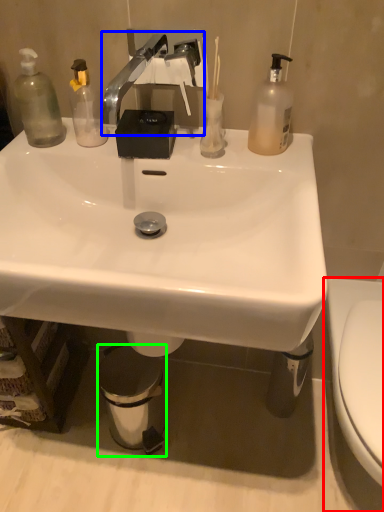
Question: Which is nearer to the toilet (highlighted by a red box)? faucet (highlighted by a blue box) or trash bin/can (highlighted by a green box).

Choices:
 (A) faucet
 (B) trash bin/can

Answer: (B)